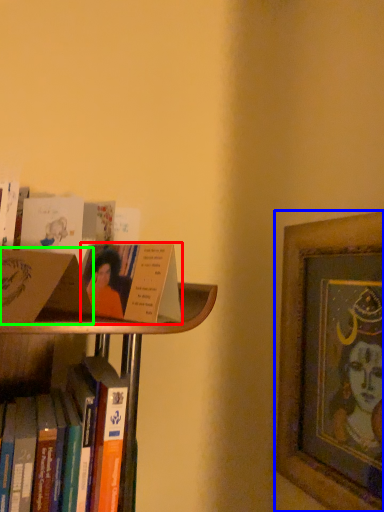
Question: Which object is the farthest from book (highlighted by a red box)? Choose among these: picture frame (highlighted by a blue box) or paperback book (highlighted by a green box).

Choices:
 (A) picture frame
 (B) paperback book

Answer: (A)